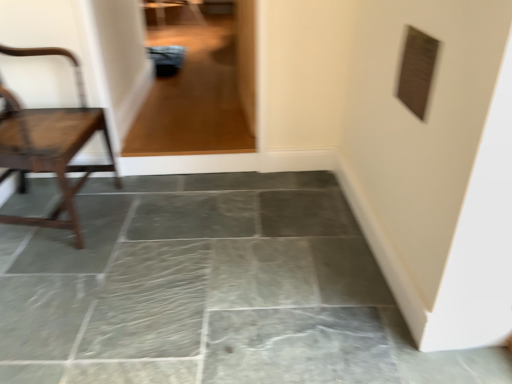
You are a GUI agent. You are given a task and a screenshot of the screen. Output one action in this format:
    pyautogui.click(x=<x>, y=<y>)
    Task: Click on the free point below wooden chair at left (from a real-world perspective)
    The height and width of the screenshot is (384, 512).
    Given the screenshot: What is the action you would take?
    pyautogui.click(x=51, y=214)